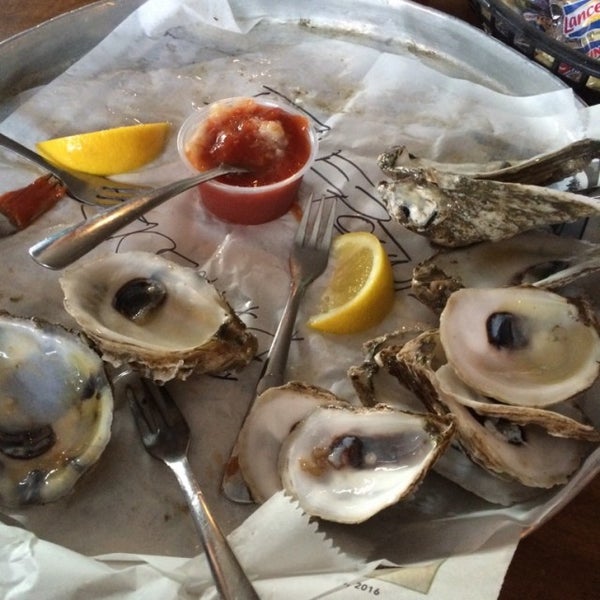
The height and width of the screenshot is (600, 600). What are the coordinates of `fork or spoon handle` in the screenshot? It's located at (135, 209).